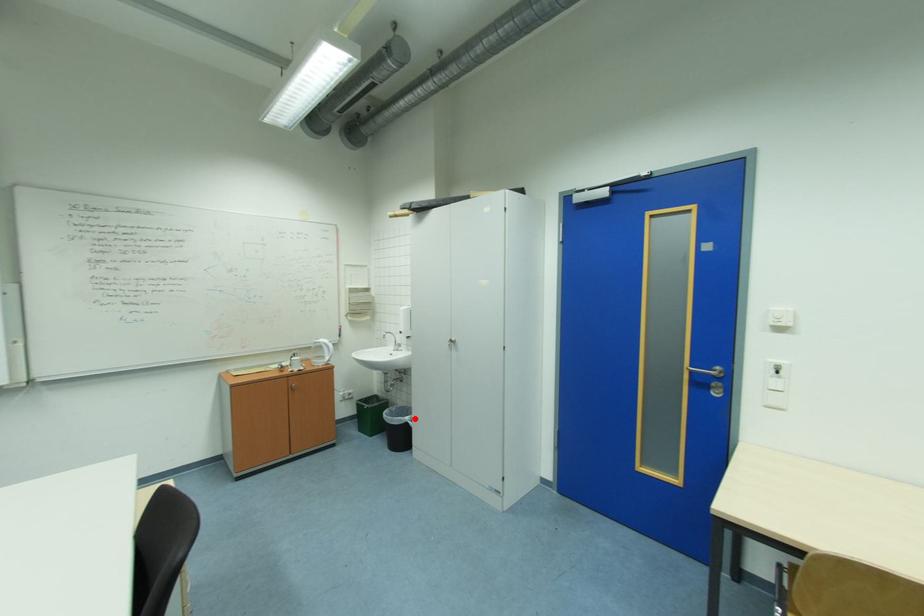
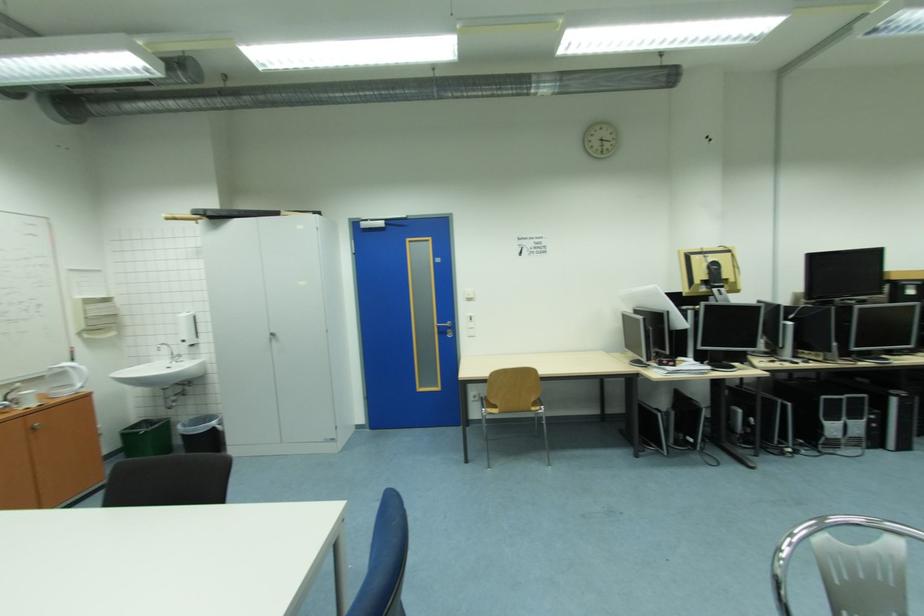
Question: I am providing you with two images of the same scene from different viewpoints. A red point is marked on the first image. Is the red point's position out of view in image 2?

Choices:
 (A) Yes
 (B) No

Answer: (B)